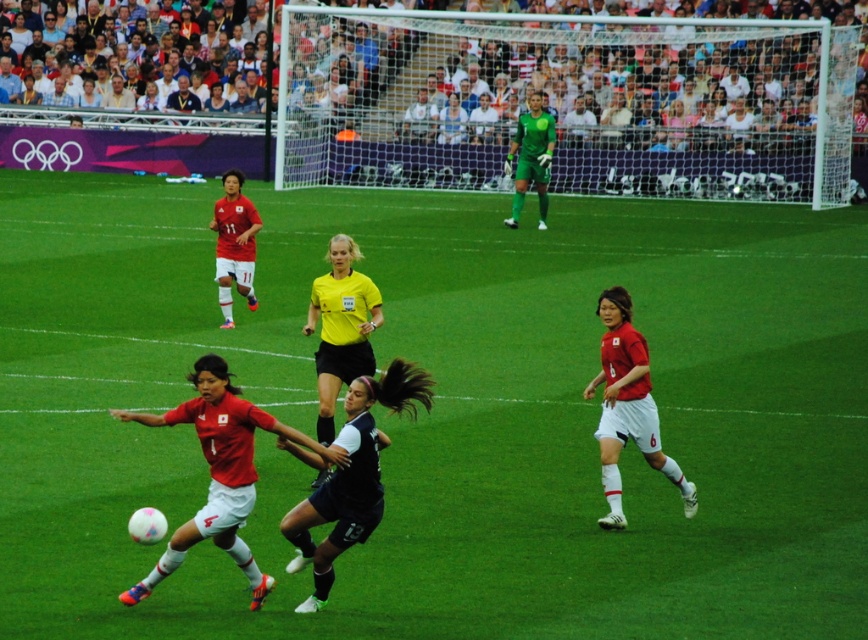
Looking at this image, you are a soccer referee standing at the edge of the field. You need to determine if the matte red jersey at center is within the boundaries of the green grass football field at center. Based on the spatial relationship between them, can you confirm if the jersey is on the field?

The green grass football field at center might be wider than matte red jersey at center, so the matte red jersey at center is likely within the field boundaries since the field is wider.

You are a soccer referee standing at the edge of the field. You need to determine if the matte red jersey at center is entirely within the boundaries of the green grass football field at center. Can you confirm this?

The green grass football field at center has a larger size compared to matte red jersey at center, so the matte red jersey at center is entirely within the boundaries of the green grass football field at center.

You are a soccer referee at the Olympic match. You need to determine if the ball, which is currently midair near the feet of the player in the matte red jersey at center, is heading towards the white mesh net at center. Based on their positions, can you confirm whether the ball is moving toward the net?

The white mesh net at center is located above the matte red jersey at center, so the ball midair near the matte red jersey at center is heading upward towards the white mesh net at center.